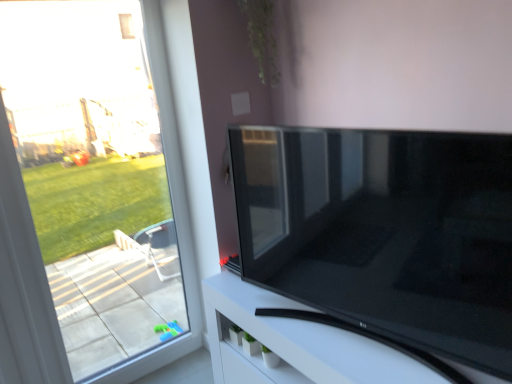
Image resolution: width=512 pixels, height=384 pixels. What do you see at coordinates (91, 195) in the screenshot? I see `transparent glass window at left` at bounding box center [91, 195].

What is the approximate width of black glossy tv stand at lower right?

It is 14.45 inches.

The width and height of the screenshot is (512, 384). In order to click on green matte plant at upper center in this screenshot , I will do `click(262, 37)`.

Is black glossy tv stand at lower right shorter than matte black tv at center?

Correct, black glossy tv stand at lower right is not as tall as matte black tv at center.

From the image's perspective, relative to matte black tv at center, is black glossy tv stand at lower right above or below?

From the image's perspective, black glossy tv stand at lower right appears below matte black tv at center.

Are black glossy tv stand at lower right and matte black tv at center far apart?

No, there isn't a large distance between black glossy tv stand at lower right and matte black tv at center.

Is black glossy tv stand at lower right not within matte black tv at center?

Absolutely, black glossy tv stand at lower right is external to matte black tv at center.

From a real-world perspective, is matte black tv at center physically located above or below transparent glass window at left?

matte black tv at center is situated lower than transparent glass window at left in the real world.

How many degrees apart are the facing directions of matte black tv at center and transparent glass window at left?

The facing directions of matte black tv at center and transparent glass window at left are 77.9 degrees apart.

Considering the positions of objects matte black tv at center and transparent glass window at left in the image provided, who is in front, matte black tv at center or transparent glass window at left?

matte black tv at center is closer to the camera.

Between matte black tv at center and transparent glass window at left, which one has smaller size?

Smaller between the two is matte black tv at center.

Can you confirm if matte black tv at center is positioned to the left of green matte plant at upper center?

Incorrect, matte black tv at center is not on the left side of green matte plant at upper center.

Based on the photo, is matte black tv at center shorter than green matte plant at upper center?

Incorrect, the height of matte black tv at center does not fall short of that of green matte plant at upper center.

Is there a large distance between matte black tv at center and green matte plant at upper center?

They are positioned close to each other.

Does point (370, 173) lie in front of point (264, 29)?

Yes, it is.

From a real-world perspective, is green matte plant at upper center positioned over matte black tv at center based on gravity?

Indeed, from a real-world perspective, green matte plant at upper center stands above matte black tv at center.

Does green matte plant at upper center have a greater width compared to matte black tv at center?

In fact, green matte plant at upper center might be narrower than matte black tv at center.

At what (x,y) coordinates should I click in order to perform the action: click on plant behind the matte black tv at center. Please return your answer as a coordinate pair (x, y). Looking at the image, I should click on (262, 37).

Which is more distant, [121,345] or [222,338]?

The point [121,345] is more distant.

Between transparent glass window at left and black glossy tv stand at lower right, which one has larger size?

black glossy tv stand at lower right is bigger.

Between transparent glass window at left and black glossy tv stand at lower right, which one has larger width?

black glossy tv stand at lower right.

Is matte black tv at center oriented away from black glossy tv stand at lower right?

matte black tv at center does not have its back to black glossy tv stand at lower right.

Is there a large distance between matte black tv at center and black glossy tv stand at lower right?

Actually, matte black tv at center and black glossy tv stand at lower right are a little close together.

Is matte black tv at center to the left of black glossy tv stand at lower right from the viewer's perspective?

Indeed, matte black tv at center is positioned on the left side of black glossy tv stand at lower right.

Considering the sizes of objects matte black tv at center and black glossy tv stand at lower right in the image provided, who is shorter, matte black tv at center or black glossy tv stand at lower right?

Standing shorter between the two is black glossy tv stand at lower right.

Between black glossy tv stand at lower right and transparent glass window at left, which one has larger size?

Bigger between the two is black glossy tv stand at lower right.

Considering the relative positions of black glossy tv stand at lower right and transparent glass window at left in the image provided, is black glossy tv stand at lower right to the right of transparent glass window at left from the viewer's perspective?

Yes.

What are the coordinates of `window lying on the left of black glossy tv stand at lower right` in the screenshot? It's located at (91, 195).

How many degrees apart are the facing directions of black glossy tv stand at lower right and transparent glass window at left?

The facing directions of black glossy tv stand at lower right and transparent glass window at left are 87.8 degrees apart.

I want to click on furniture on the right of matte black tv at center, so click(309, 343).

Find the location of a particular element. This screenshot has width=512, height=384. window above the matte black tv at center (from the image's perspective) is located at coordinates (91, 195).

When comparing their distances from transparent glass window at left, does matte black tv at center or green matte plant at upper center seem further?

The object further to transparent glass window at left is green matte plant at upper center.

Based on their spatial positions, is black glossy tv stand at lower right or green matte plant at upper center closer to transparent glass window at left?

black glossy tv stand at lower right lies closer to transparent glass window at left than the other object.

From the picture: Estimate the real-world distances between objects in this image. Which object is closer to transparent glass window at left, green matte plant at upper center or black glossy tv stand at lower right?

Among the two, black glossy tv stand at lower right is located nearer to transparent glass window at left.

Estimate the real-world distances between objects in this image. Which object is further from green matte plant at upper center, transparent glass window at left or matte black tv at center?

transparent glass window at left lies further to green matte plant at upper center than the other object.

Based on their spatial positions, is green matte plant at upper center or transparent glass window at left closer to matte black tv at center?

The object closer to matte black tv at center is green matte plant at upper center.

Estimate the real-world distances between objects in this image. Which object is further from green matte plant at upper center, transparent glass window at left or black glossy tv stand at lower right?

transparent glass window at left.

From the image, which object appears to be nearer to transparent glass window at left, black glossy tv stand at lower right or matte black tv at center?

matte black tv at center lies closer to transparent glass window at left than the other object.

Considering their positions, is matte black tv at center positioned closer to black glossy tv stand at lower right than green matte plant at upper center?

matte black tv at center.

Locate an element on the screen. television between transparent glass window at left and black glossy tv stand at lower right from left to right is located at coordinates (384, 232).

Identify the location of window between green matte plant at upper center and black glossy tv stand at lower right in the vertical direction. (91, 195).

Where is `plant between transparent glass window at left and matte black tv at center in the horizontal direction`? This screenshot has width=512, height=384. plant between transparent glass window at left and matte black tv at center in the horizontal direction is located at coordinates [262, 37].

Find the location of a particular element. Image resolution: width=512 pixels, height=384 pixels. television between green matte plant at upper center and black glossy tv stand at lower right from top to bottom is located at coordinates (384, 232).